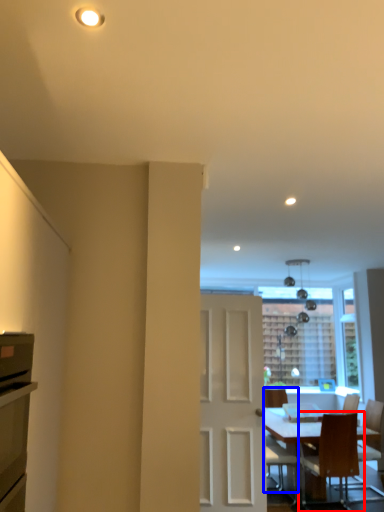
Question: Which object is further to the camera taking this photo, chair (highlighted by a red box) or chair (highlighted by a blue box)?

Choices:
 (A) chair
 (B) chair

Answer: (B)